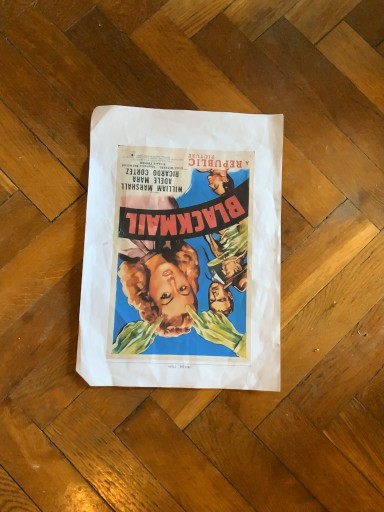
Identify the location of matte paper poster at center. (182, 250).

What do you see at coordinates (182, 250) in the screenshot? The width and height of the screenshot is (384, 512). I see `matte paper poster at center` at bounding box center [182, 250].

At what (x,y) coordinates should I click in order to perform the action: click on matte paper poster at center. Please return your answer as a coordinate pair (x, y). Looking at the image, I should click on (182, 250).